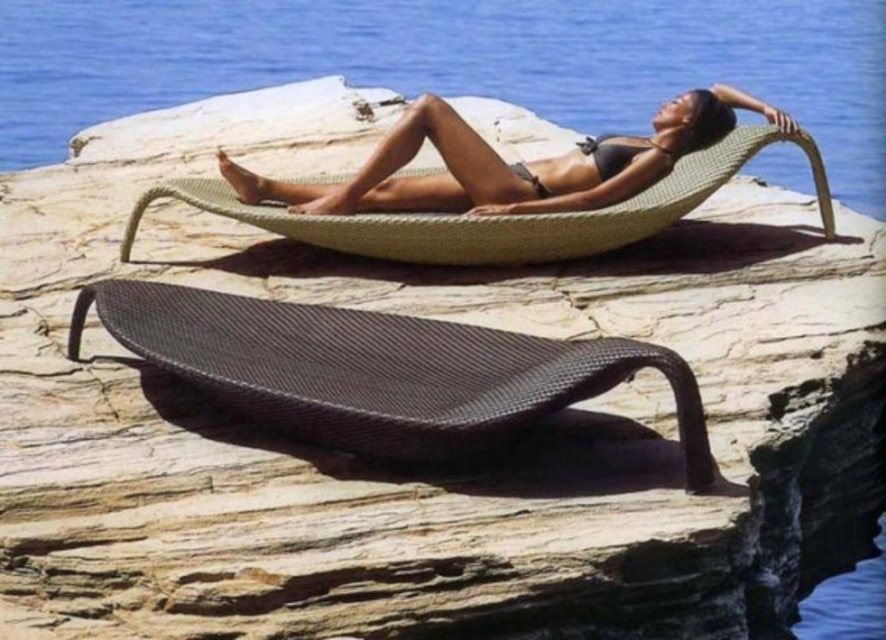
Question: Which is nearer to the beige woven hammock at center?

Choices:
 (A) clear blue water at upper center
 (B) matte black daybed at center
 (C) matte black bikini at center

Answer: (C)

Question: Estimate the real-world distances between objects in this image. Which object is closer to the clear blue water at upper center?

Choices:
 (A) matte black bikini at center
 (B) matte black daybed at center

Answer: (A)

Question: Is matte black bikini at center thinner than beige woven hammock at center?

Choices:
 (A) no
 (B) yes

Answer: (A)

Question: Which of the following is the farthest from the observer?

Choices:
 (A) clear blue water at upper center
 (B) matte black bikini at center
 (C) beige woven hammock at center

Answer: (A)

Question: Observing the image, what is the correct spatial positioning of matte black daybed at center in reference to matte black bikini at center?

Choices:
 (A) left
 (B) right

Answer: (A)

Question: Is matte black bikini at center above beige woven hammock at center?

Choices:
 (A) no
 (B) yes

Answer: (B)